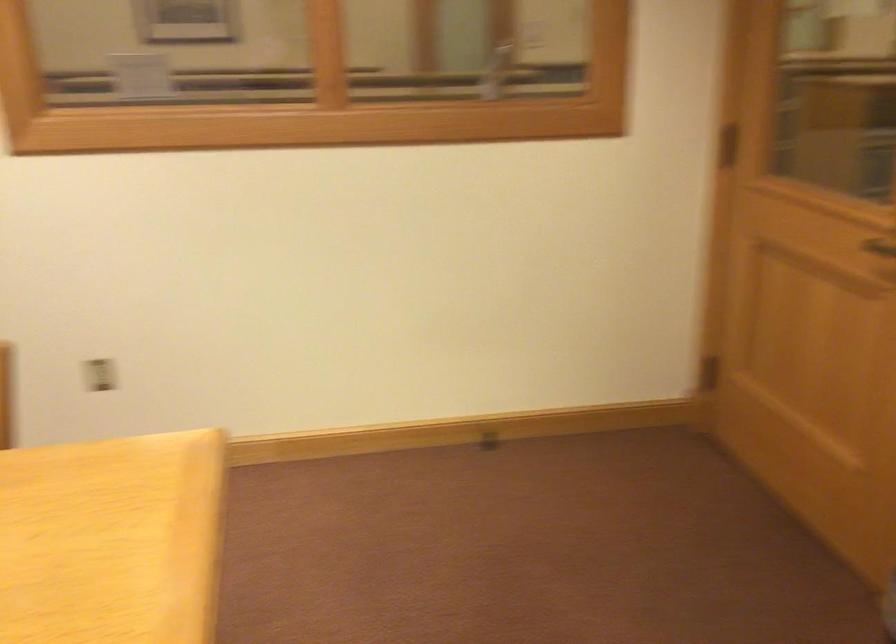
Question: The images are taken continuously from a first-person perspective. In which direction is your viewpoint rotating?

Choices:
 (A) Left
 (B) Right
 (C) Up
 (D) Down

Answer: (A)